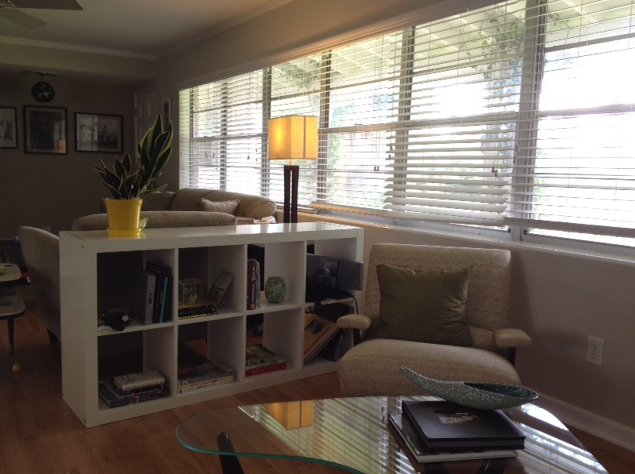
Identify the location of windows. (204, 154), (237, 154), (304, 102), (358, 154), (444, 156), (569, 147).